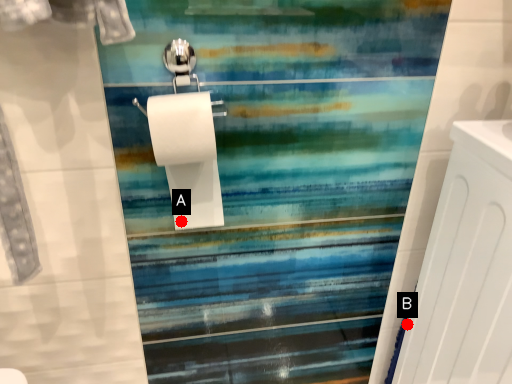
Question: Two points are circled on the image, labeled by A and B beside each circle. Which point is further to the camera?

Choices:
 (A) A is further
 (B) B is further

Answer: (B)